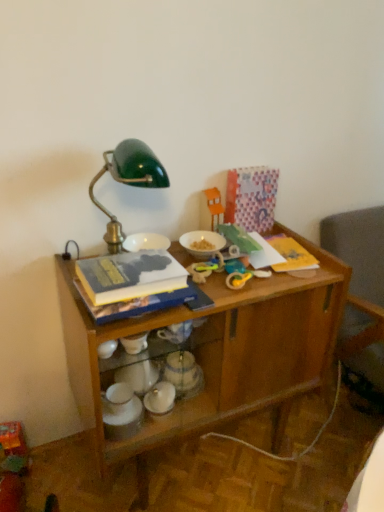
Question: Considering the relative positions of metallic silver teapot at center, placed as the 2th tableware when sorted from top to bottom, and wooden desk at center in the image provided, is metallic silver teapot at center, placed as the 2th tableware when sorted from top to bottom, to the left of wooden desk at center from the viewer's perspective?

Choices:
 (A) no
 (B) yes

Answer: (B)

Question: Is the position of metallic silver teapot at center, which is the second tableware from bottom to top, more distant than that of wooden desk at center?

Choices:
 (A) yes
 (B) no

Answer: (A)

Question: Is metallic silver teapot at center, which is the second tableware from bottom to top, surrounding wooden desk at center?

Choices:
 (A) yes
 (B) no

Answer: (B)

Question: From the image's perspective, is metallic silver teapot at center, which is the second tableware from bottom to top, located above wooden desk at center?

Choices:
 (A) no
 (B) yes

Answer: (A)

Question: Is metallic silver teapot at center, which is the second tableware from bottom to top, at the right side of wooden desk at center?

Choices:
 (A) yes
 (B) no

Answer: (B)

Question: From a real-world perspective, is hardcover book at center above or below white glossy bowls at lower center, positioned as the 1th tableware in bottom-to-top order?

Choices:
 (A) above
 (B) below

Answer: (A)

Question: Considering the positions of point (135, 281) and point (137, 400), is point (135, 281) closer or farther from the camera than point (137, 400)?

Choices:
 (A) farther
 (B) closer

Answer: (B)

Question: Visually, is hardcover book at center positioned to the left or to the right of white glossy bowls at lower center, which is the third tableware in top-to-bottom order?

Choices:
 (A) right
 (B) left

Answer: (A)

Question: Looking at their shapes, would you say hardcover book at center is wider or thinner than white glossy bowls at lower center, positioned as the 1th tableware in bottom-to-top order?

Choices:
 (A) thin
 (B) wide

Answer: (B)

Question: Relative to yellow rubber toy at center, arranged as the 1th toy when viewed from the front, is white glossy bowls at lower center, which is the third tableware in top-to-bottom order, in front or behind?

Choices:
 (A) behind
 (B) front

Answer: (B)

Question: In the image, is white glossy bowls at lower center, positioned as the 1th tableware in bottom-to-top order, on the left side or the right side of yellow rubber toy at center, the third toy in the top-to-bottom sequence?

Choices:
 (A) left
 (B) right

Answer: (A)

Question: Is white glossy bowls at lower center, positioned as the 1th tableware in bottom-to-top order, spatially inside yellow rubber toy at center, the third toy in the top-to-bottom sequence, or outside of it?

Choices:
 (A) inside
 (B) outside

Answer: (B)

Question: Looking at their shapes, would you say white glossy bowls at lower center, which is the 3th tableware from right to left, is wider or thinner than yellow rubber toy at center, the third toy in the top-to-bottom sequence?

Choices:
 (A) wide
 (B) thin

Answer: (A)

Question: Considering the positions of orange plastic toy at upper center, marked as the 3th toy in a front-to-back arrangement, and white glossy bowls at lower center, the first tableware viewed from the left, in the image, is orange plastic toy at upper center, marked as the 3th toy in a front-to-back arrangement, bigger or smaller than white glossy bowls at lower center, the first tableware viewed from the left,?

Choices:
 (A) big
 (B) small

Answer: (A)

Question: From the image's perspective, is orange plastic toy at upper center, marked as the 3th toy in a front-to-back arrangement, located above or below white glossy bowls at lower center, which is the 3th tableware from right to left?

Choices:
 (A) above
 (B) below

Answer: (A)